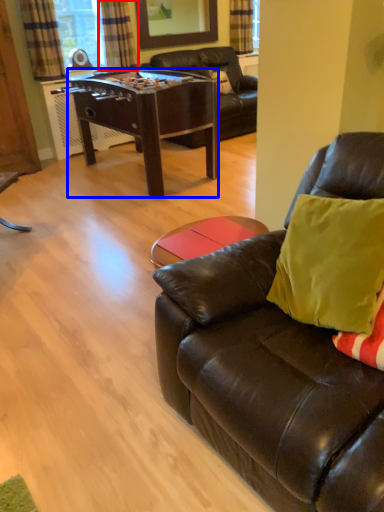
Question: Among these objects, which one is nearest to the camera, curtain (highlighted by a red box) or desk (highlighted by a blue box)?

Choices:
 (A) curtain
 (B) desk

Answer: (B)